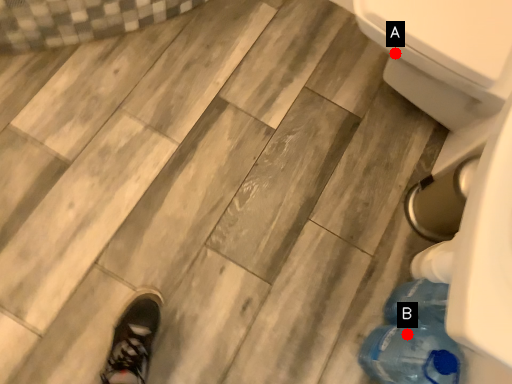
Question: Two points are circled on the image, labeled by A and B beside each circle. Which of the following is the closest to the observer?

Choices:
 (A) A is closer
 (B) B is closer

Answer: (B)